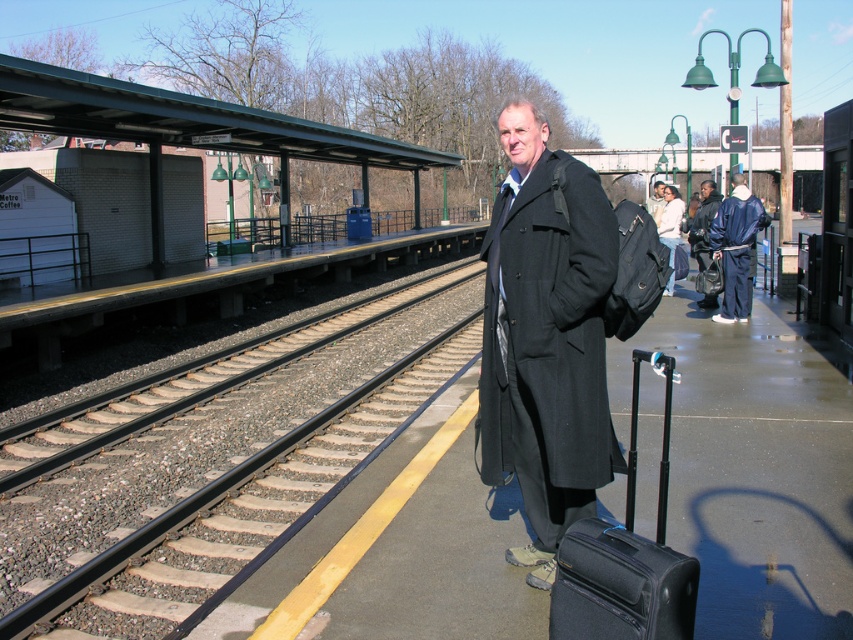
Question: Which object appears closest to the camera in this image?

Choices:
 (A) dark gray coat at center
 (B) black woolen coat at center
 (C) matte black coat at center
 (D) black hardshell suitcase at lower right

Answer: (D)

Question: Among these objects, which one is nearest to the camera?

Choices:
 (A) dark blue jacket at center
 (B) dark gray coat at center
 (C) matte black coat at center

Answer: (C)

Question: Estimate the real-world distances between objects in this image. Which object is closer to the black hardshell suitcase at lower right?

Choices:
 (A) matte black coat at center
 (B) dark blue jacket at center

Answer: (A)

Question: Is blue tracksuit at right above dark gray coat at center?

Choices:
 (A) no
 (B) yes

Answer: (A)

Question: Is black woolen coat at center further to the viewer compared to dark blue jacket at center?

Choices:
 (A) no
 (B) yes

Answer: (A)

Question: In this image, where is blue tracksuit at right located relative to dark blue jacket at center?

Choices:
 (A) left
 (B) right

Answer: (A)